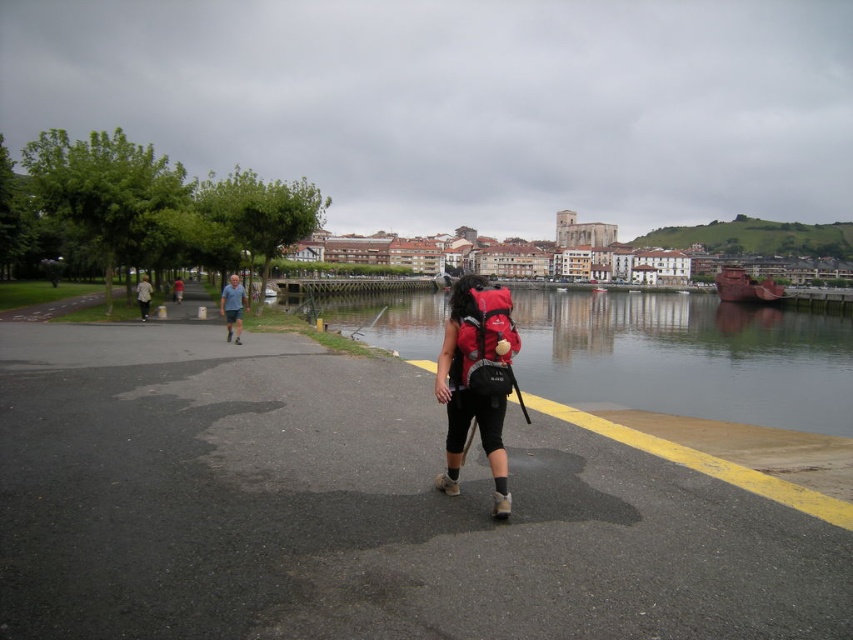
Question: Which object is the farthest from the red matte backpack at center?

Choices:
 (A) smooth concrete river at center
 (B) light gray fabric pants at center
 (C) gray fabric shorts at left
 (D) matte red backpack at center

Answer: (B)

Question: Can you confirm if red matte backpack at center is wider than light gray fabric pants at center?

Choices:
 (A) no
 (B) yes

Answer: (A)

Question: Which point is closer to the camera taking this photo?

Choices:
 (A) (506, 333)
 (B) (148, 298)
 (C) (549, 376)
 (D) (241, 288)

Answer: (A)

Question: Among these objects, which one is nearest to the camera?

Choices:
 (A) matte red backpack at center
 (B) red matte backpack at center
 (C) smooth concrete river at center
 (D) light gray fabric pants at center

Answer: (B)

Question: Is red matte backpack at center bigger than light gray fabric jacket at left?

Choices:
 (A) yes
 (B) no

Answer: (A)

Question: Does smooth concrete river at center have a lesser width compared to matte red backpack at center?

Choices:
 (A) no
 (B) yes

Answer: (A)